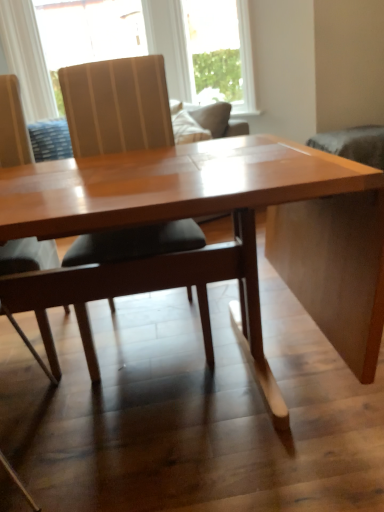
Question: Is translucent fabric at upper center, the second window in the right-to-left sequence, inside the boundaries of clear glass window at upper center, which is the first window from right to left, or outside?

Choices:
 (A) inside
 (B) outside

Answer: (B)

Question: Does point (135, 54) appear closer or farther from the camera than point (251, 96)?

Choices:
 (A) closer
 (B) farther

Answer: (B)

Question: Based on their relative distances, which object is farther from the wooden table at center?

Choices:
 (A) clear glass window at upper center, the 2th window from the left
 (B) matte wood chair at center, positioned as the second chair in left-to-right order
 (C) translucent fabric at upper center, the second window in the right-to-left sequence
 (D) matte wood chair at left, which ranks as the second chair in right-to-left order

Answer: (A)

Question: Which object is the farthest from the matte wood chair at left, the first chair in the left-to-right sequence?

Choices:
 (A) wooden table at center
 (B) translucent fabric at upper center, the second window in the right-to-left sequence
 (C) clear glass window at upper center, which is the first window from right to left
 (D) matte wood chair at center, positioned as the second chair in left-to-right order

Answer: (C)